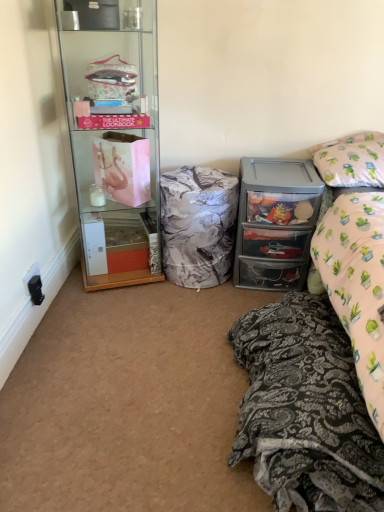
Question: Is patterned fabric bed at lower right bigger than black plastic power outlet at lower left?

Choices:
 (A) no
 (B) yes

Answer: (B)

Question: Is patterned fabric bed at lower right positioned beyond the bounds of black plastic power outlet at lower left?

Choices:
 (A) yes
 (B) no

Answer: (A)

Question: Is patterned fabric bed at lower right taller than black plastic power outlet at lower left?

Choices:
 (A) yes
 (B) no

Answer: (A)

Question: From the image's perspective, is patterned fabric bed at lower right below black plastic power outlet at lower left?

Choices:
 (A) yes
 (B) no

Answer: (A)

Question: Is black plastic power outlet at lower left completely or partially inside patterned fabric bed at lower right?

Choices:
 (A) no
 (B) yes

Answer: (A)

Question: Is patterned fabric bed at lower right placed right next to black plastic power outlet at lower left?

Choices:
 (A) no
 (B) yes

Answer: (A)

Question: Is clear glass cabinet at left taller than pink fabric pillow at upper right?

Choices:
 (A) no
 (B) yes

Answer: (B)

Question: Can you confirm if clear glass cabinet at left is thinner than pink fabric pillow at upper right?

Choices:
 (A) no
 (B) yes

Answer: (A)

Question: Is clear glass cabinet at left turned away from pink fabric pillow at upper right?

Choices:
 (A) no
 (B) yes

Answer: (A)

Question: Can you confirm if clear glass cabinet at left is bigger than pink fabric pillow at upper right?

Choices:
 (A) yes
 (B) no

Answer: (A)

Question: Can you confirm if clear glass cabinet at left is wider than pink fabric pillow at upper right?

Choices:
 (A) no
 (B) yes

Answer: (B)

Question: Could you tell me if clear glass cabinet at left is turned towards pink fabric pillow at upper right?

Choices:
 (A) no
 (B) yes

Answer: (A)

Question: Considering the relative sizes of clear plastic drawers at right and clear glass cabinet at left in the image provided, is clear plastic drawers at right taller than clear glass cabinet at left?

Choices:
 (A) yes
 (B) no

Answer: (B)